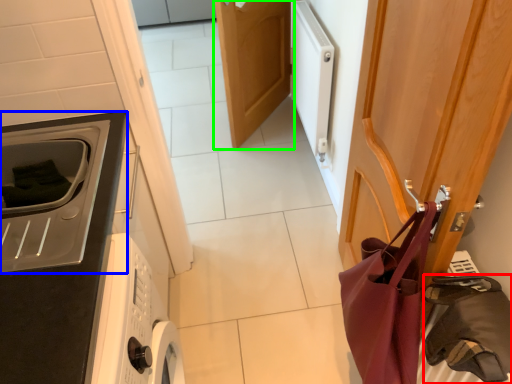
Question: Based on their relative distances, which object is nearer to bag (highlighted by a red box)? Choose from home appliance (highlighted by a blue box) and door (highlighted by a green box).

Choices:
 (A) home appliance
 (B) door

Answer: (A)